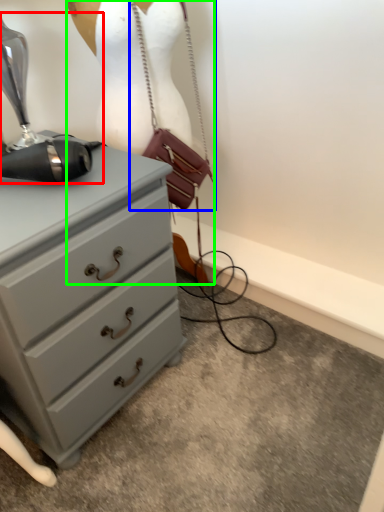
Question: Which object is the closest to the sewing machine (highlighted by a red box)? Choose among these: handbag (highlighted by a blue box) or mannequin (highlighted by a green box).

Choices:
 (A) handbag
 (B) mannequin

Answer: (B)